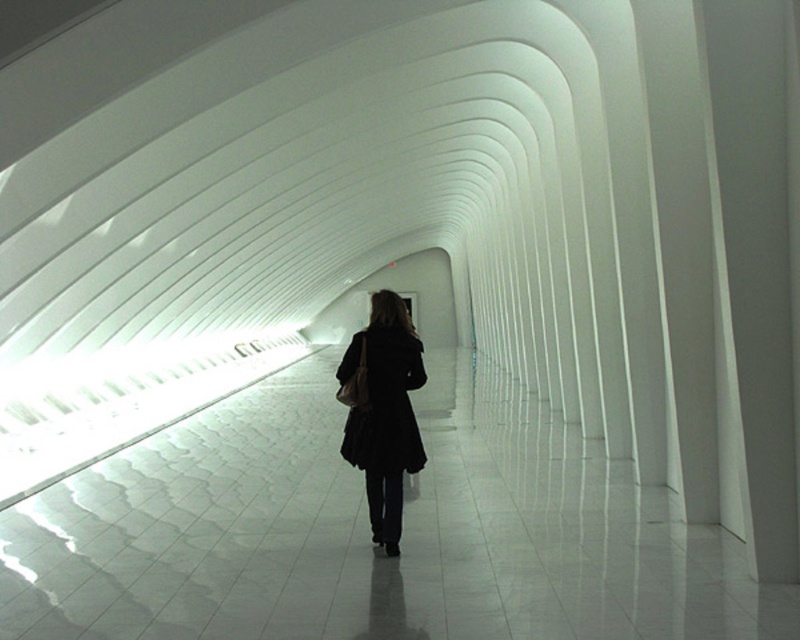
You are standing in the modern architectural interior with curved white walls. You see the white glossy floor at center. If you were to place a small decorative object exactly at the coordinate point mentioned in the description, where would that object be located in relation to the floor?

The object would be placed directly on the white glossy floor at center since the coordinates provided correspond to its 2D location on the floor.

You are standing in the curved white tunnel and see two points marked on the wall. The first point is at coordinate point (74, 524) and the second is at point (376, 413). Which point is closer to you?

Point (74, 524) is closer to you because it is further to the viewer than point (376, 413).

You are standing in the modern architectural interior and want to place a small decorative item on the surface that is closer to you. Which object between the white glossy floor at center and the black matte coat at center should you choose?

The white glossy floor at center is closer to the viewer than the black matte coat at center, so you should place the decorative item on the white glossy floor at center.